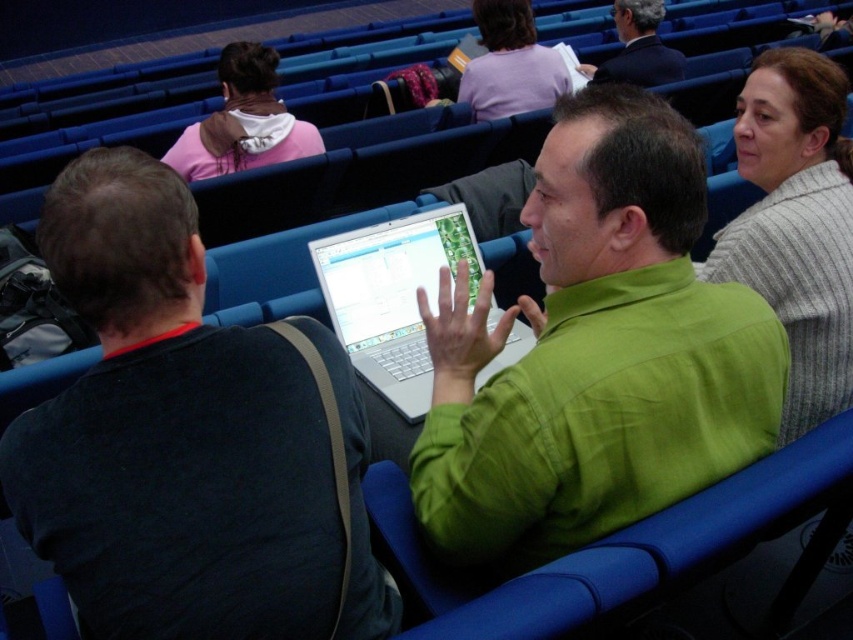
You are sitting in the auditorium and want to check both the black matte laptop at left and the silver metallic laptop at center. Which one is positioned lower in the image?

The black matte laptop at left is located below the silver metallic laptop at center, so it is positioned lower in the image.

You are sitting in the auditorium and need to hand a document to the person wearing the gray striped sweater at upper right. Based on their position, which direction should you move to reach them?

The gray striped sweater at upper right is located at point [796,225], so you should move towards the upper right direction to reach them.